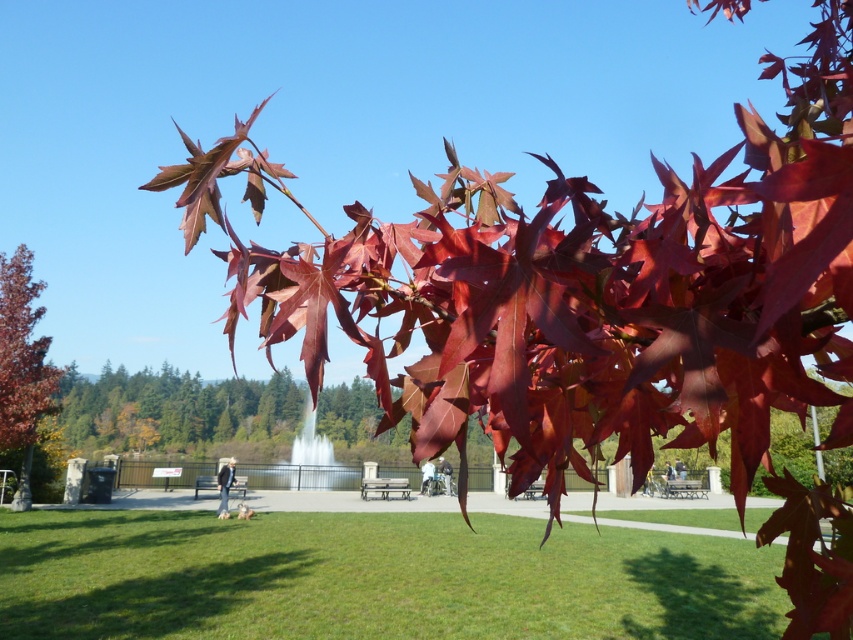
You are standing in the park and want to pick up the shiny red maple leaf at center. However, there is a metallic silver bench at center in your way. Can you reach the leaf without moving the bench?

The shiny red maple leaf at center is closer to the viewer than the metallic silver bench at center, so you can reach it without needing to move the bench.

You are standing at the entrance of the park and see the shiny red maple leaf at center and the metallic silver bench at center. Which object is positioned to the right side of the other?

The shiny red maple leaf at center is to the right of the metallic silver bench at center.

You are standing in the park and notice two maple leaves at the center of the image. Which one is closer to you, the glossy red maple leaves at center or the shiny red maple leaf at center?

The glossy red maple leaves at center are closer to you because the shiny red maple leaf at center is positioned behind them.